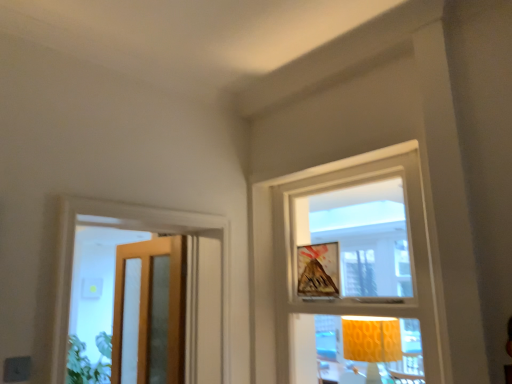
Question: Does clear glass door at left, arranged as the 2th window when viewed from the right, turn towards wooden glass door at left?

Choices:
 (A) yes
 (B) no

Answer: (B)

Question: Can you confirm if clear glass door at left, arranged as the 2th window when viewed from the right, is thinner than wooden glass door at left?

Choices:
 (A) yes
 (B) no

Answer: (B)

Question: Is clear glass door at left, arranged as the 2th window when viewed from the right, taller than wooden glass door at left?

Choices:
 (A) yes
 (B) no

Answer: (B)

Question: Does clear glass door at left, which ranks as the 1th window in left-to-right order, have a greater width compared to wooden glass door at left?

Choices:
 (A) no
 (B) yes

Answer: (B)

Question: In terms of width, does wooden glass door at left look wider or thinner when compared to matte yellow fabric lampshade at center?

Choices:
 (A) thin
 (B) wide

Answer: (A)

Question: In the image, is wooden glass door at left positioned in front of or behind matte yellow fabric lampshade at center?

Choices:
 (A) behind
 (B) front

Answer: (A)

Question: Considering the positions of wooden glass door at left and matte yellow fabric lampshade at center in the image, is wooden glass door at left bigger or smaller than matte yellow fabric lampshade at center?

Choices:
 (A) big
 (B) small

Answer: (A)

Question: Considering the positions of wooden glass door at left and matte yellow fabric lampshade at center in the image, is wooden glass door at left taller or shorter than matte yellow fabric lampshade at center?

Choices:
 (A) tall
 (B) short

Answer: (A)

Question: Does point (342, 327) appear closer or farther from the camera than point (332, 297)?

Choices:
 (A) closer
 (B) farther

Answer: (B)

Question: From the image's perspective, is matte yellow fabric lampshade at center above or below white textured frame at upper center, which is the 2th window from left to right?

Choices:
 (A) below
 (B) above

Answer: (A)

Question: Is matte yellow fabric lampshade at center inside or outside of white textured frame at upper center, which is the 2th window from left to right?

Choices:
 (A) outside
 (B) inside

Answer: (B)

Question: In terms of size, does matte yellow fabric lampshade at center appear bigger or smaller than white textured frame at upper center, which is the 2th window from left to right?

Choices:
 (A) big
 (B) small

Answer: (B)

Question: From a real-world perspective, is white textured frame at upper center, which is the 2th window from left to right, above or below clear glass door at left, arranged as the 2th window when viewed from the right?

Choices:
 (A) above
 (B) below

Answer: (A)

Question: Is point (425, 379) closer or farther from the camera than point (58, 367)?

Choices:
 (A) closer
 (B) farther

Answer: (B)